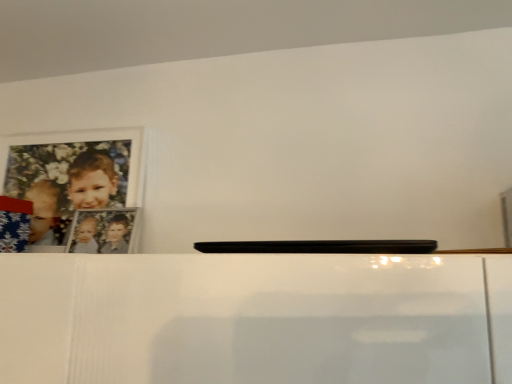
Describe the element at coordinates (70, 175) in the screenshot. I see `matte white picture frame at upper left` at that location.

Identify the location of matte white picture frame at upper left. The width and height of the screenshot is (512, 384). click(x=70, y=175).

In order to face matte white picture frame at upper left, should I rotate leftwards or rightwards?

Rotate left and turn 24.440 degrees.

Find the location of a particular element. The width and height of the screenshot is (512, 384). matte white picture frame at upper left is located at coordinates (70, 175).